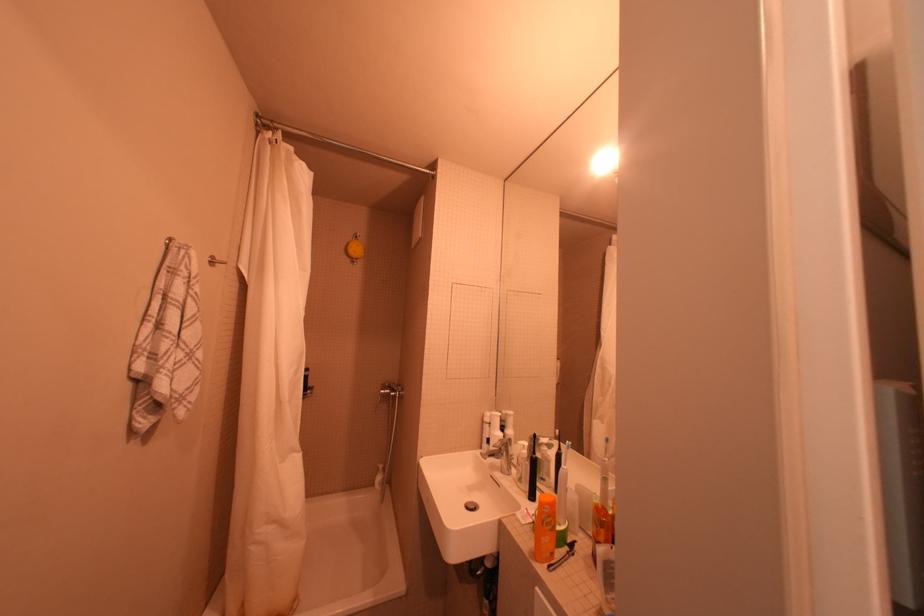
Where would you turn the shower faucet handle? Please return your answer as a coordinate pair (x, y).

(406, 394)